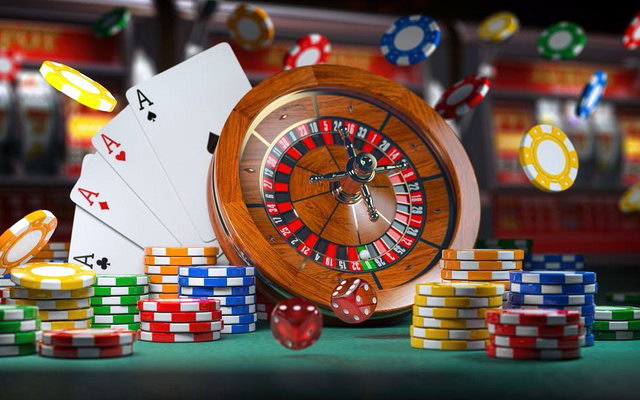
Locate an element on the screen. The image size is (640, 400). playing cards is located at coordinates (104, 266), (100, 206), (125, 159), (186, 120).